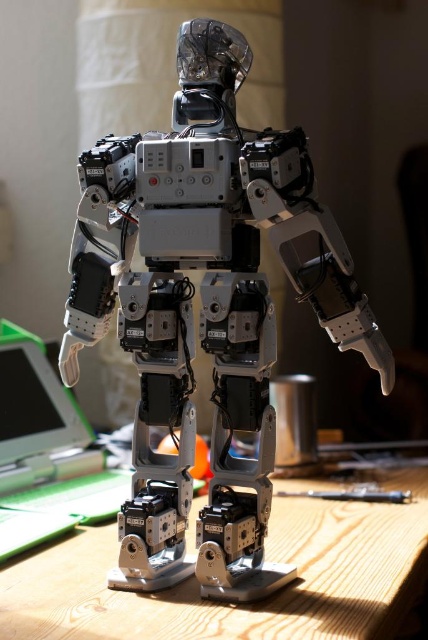
You are a maintenance technician who needs to reach the wooden table at lower center. However, there is a metallic silver robot at center in your way. Can you walk around the robot to access the table?

The metallic silver robot at center is positioned over wooden table at lower center, so you cannot walk around the robot to access the wooden table at lower center since it is directly blocking the path.

You are a delivery person who needs to place a package on the desk. The package is 12 inches wide. The metallic silver robot at center is in the way. Can you slide the package past the robot without moving it?

The metallic silver robot at center is 35.60 inches away from the edge of the desk. Since the package is only 12 inches wide, there is enough space to slide it past the robot without moving it.

You are a technician standing at the edge of the wooden desk. You need to reach the metallic silver robot at center to perform maintenance. Given that the desk is 1.2 meters wide, can you safely move to the robot without falling off the desk?

The metallic silver robot at center is located at point coordinates that are within the desk area, so yes, you can safely move to the robot without falling off the desk as its position is centrally located within the desk dimensions.